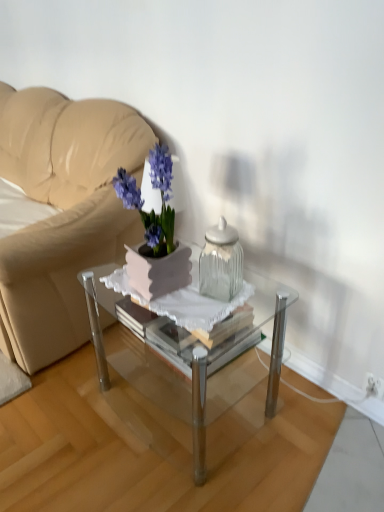
Find the location of a particular element. vacant area that lies in front of clear glass coffee table at center is located at coordinates click(x=196, y=480).